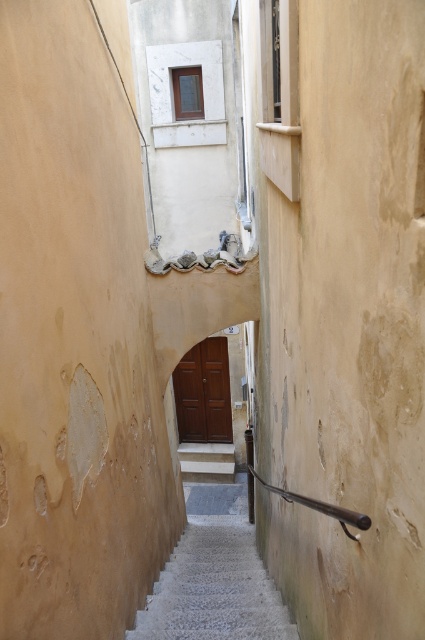
Question: Among these objects, which one is farthest from the camera?

Choices:
 (A) white concrete stairs at center
 (B) white marble stairs at center

Answer: (B)

Question: Is white concrete stairs at center closer to the viewer compared to white marble stairs at center?

Choices:
 (A) no
 (B) yes

Answer: (B)

Question: Can you confirm if white concrete stairs at center is positioned above white marble stairs at center?

Choices:
 (A) no
 (B) yes

Answer: (B)

Question: Can you confirm if white concrete stairs at center is thinner than white marble stairs at center?

Choices:
 (A) no
 (B) yes

Answer: (B)

Question: Which object is closer to the camera taking this photo?

Choices:
 (A) white concrete stairs at center
 (B) white marble stairs at center

Answer: (A)

Question: Which object is farther from the camera taking this photo?

Choices:
 (A) white marble stairs at center
 (B) white concrete stairs at center

Answer: (A)